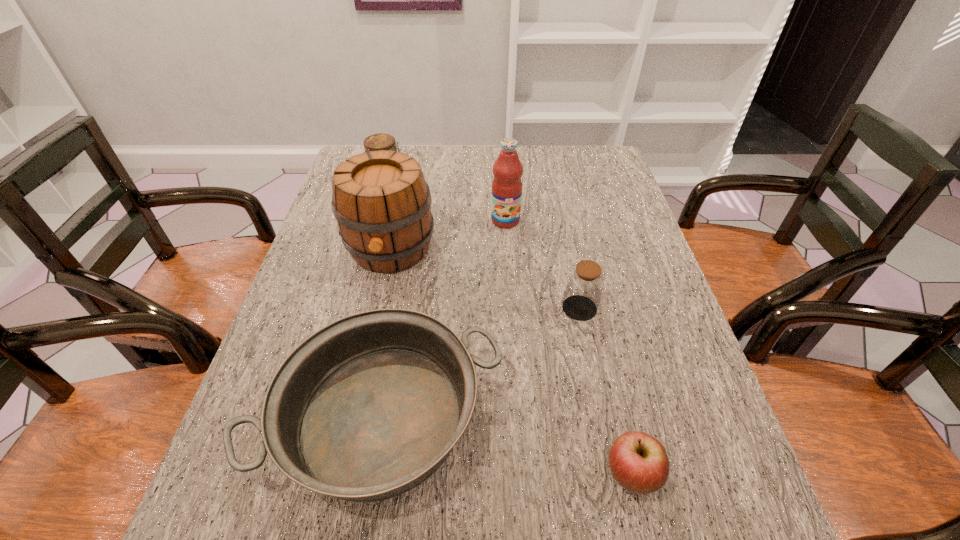
I want to click on vacant space located on the lid of the left jar, so click(445, 179).

The height and width of the screenshot is (540, 960). I want to click on vacant region located 0.090m on the front of the nearer jar, so click(589, 354).

Identify the location of vacant position located on the right of the pan. The image size is (960, 540). (543, 419).

You are a GUI agent. You are given a task and a screenshot of the screen. Output one action in this format:
    pyautogui.click(x=<x>, y=<y>)
    Task: Click on the vacant area situated 0.140m on the right of the apple
    
    Given the screenshot: What is the action you would take?
    (737, 476)

The width and height of the screenshot is (960, 540). In order to click on object located at the far edge in this screenshot , I will do `click(381, 141)`.

Identify the location of object that is at the near edge. (365, 409).

Locate an element on the screen. The width and height of the screenshot is (960, 540). cider at the left edge is located at coordinates (382, 204).

Locate an element on the screen. The width and height of the screenshot is (960, 540). jar that is at the left edge is located at coordinates (381, 141).

The image size is (960, 540). Identify the location of pan at the left edge. (365, 409).

The height and width of the screenshot is (540, 960). What are the coordinates of `object that is positioned at the right edge` in the screenshot? It's located at (639, 463).